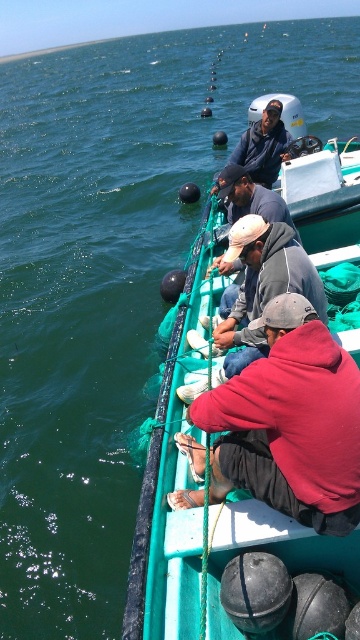
Question: Observing the image, what is the correct spatial positioning of dark gray hoodie at center in reference to dark blue fabric jacket at center?

Choices:
 (A) below
 (B) above

Answer: (A)

Question: Based on their relative distances, which object is farther from the red hoodie at center?

Choices:
 (A) dark gray hoodie at center
 (B) dark blue fabric jacket at center

Answer: (B)

Question: Among these objects, which one is farthest from the camera?

Choices:
 (A) dark gray hoodie at center
 (B) gray hoodie at center

Answer: (B)

Question: Based on their relative distances, which object is nearer to the gray hoodie at center?

Choices:
 (A) red hoodie at center
 (B) dark blue fabric jacket at center

Answer: (A)

Question: Considering the relative positions of red hoodie at center and dark blue fabric jacket at center in the image provided, where is red hoodie at center located with respect to dark blue fabric jacket at center?

Choices:
 (A) above
 (B) below

Answer: (B)

Question: Can you confirm if red hoodie at center is smaller than dark blue fabric jacket at center?

Choices:
 (A) no
 (B) yes

Answer: (A)